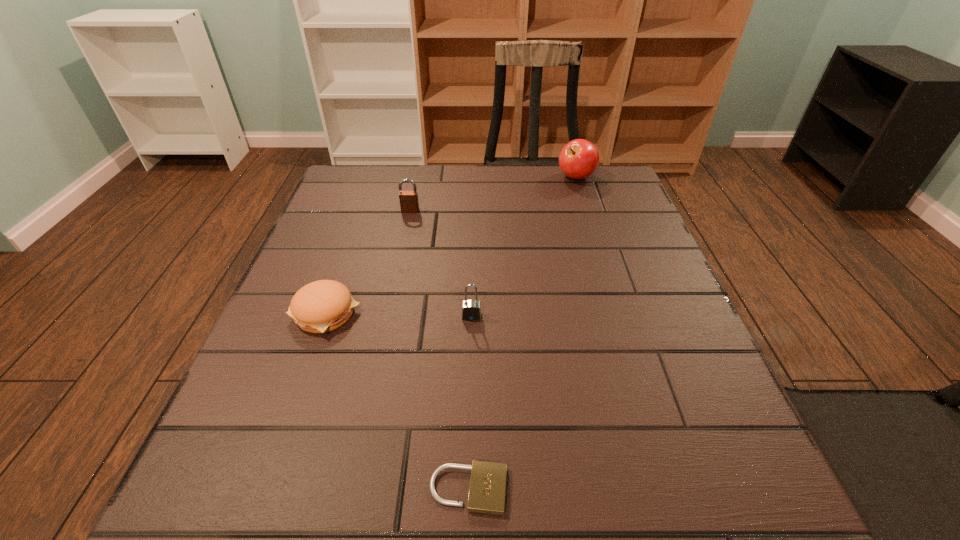
The height and width of the screenshot is (540, 960). What are the coordinates of `blank area in the image that satisfies the following two spatial constraints: 1. on the shackle of the shortest padlock; 2. on the left side of the second nearest padlock` in the screenshot? It's located at (468, 489).